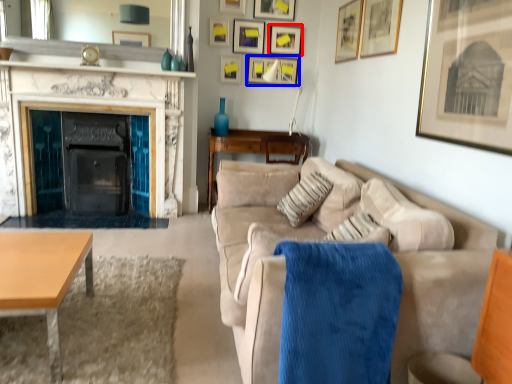
Question: Which point is closer to the camera, picture frame (highlighted by a red box) or picture frame (highlighted by a blue box)?

Choices:
 (A) picture frame
 (B) picture frame

Answer: (A)